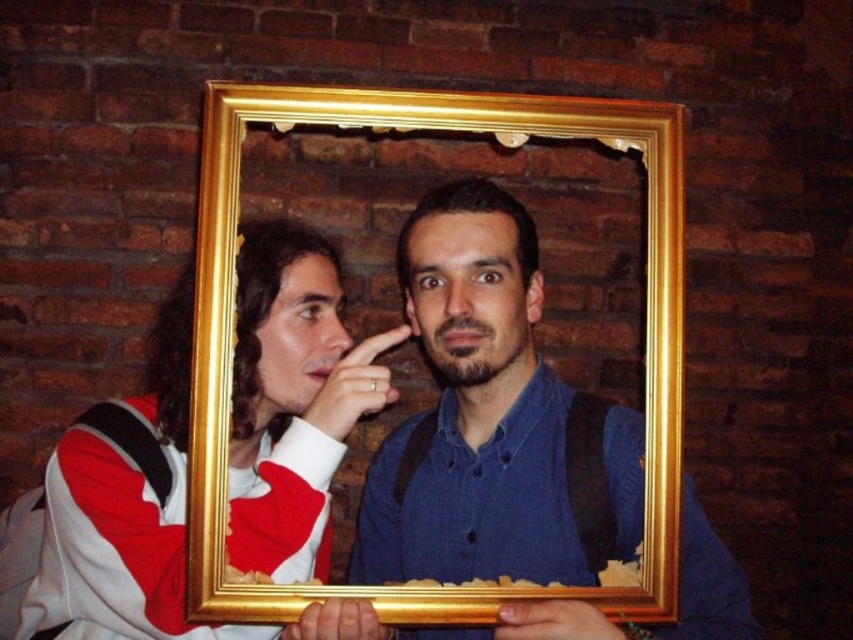
Question: Among these objects, which one is farthest from the camera?

Choices:
 (A) gold metallic picture frame at center
 (B) matte white jacket at left

Answer: (B)

Question: Which point is closer to the camera?

Choices:
 (A) matte white jacket at left
 (B) gold metallic picture frame at center

Answer: (B)

Question: Considering the relative positions of matte white jacket at left and gold metallic picture frame at center in the image provided, where is matte white jacket at left located with respect to gold metallic picture frame at center?

Choices:
 (A) right
 (B) left

Answer: (B)

Question: Considering the relative positions of matte white jacket at left and gold metallic picture frame at center in the image provided, where is matte white jacket at left located with respect to gold metallic picture frame at center?

Choices:
 (A) right
 (B) left

Answer: (B)

Question: Does matte white jacket at left appear under gold metallic picture frame at center?

Choices:
 (A) yes
 (B) no

Answer: (A)

Question: Among these points, which one is farthest from the camera?

Choices:
 (A) (67, 579)
 (B) (636, 109)

Answer: (A)